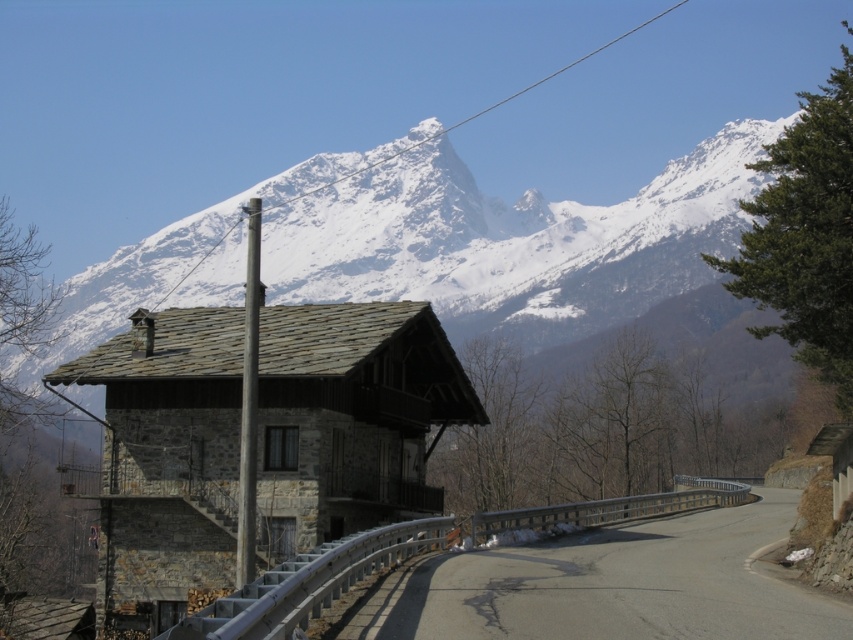
Which of these two, snowy granite mountain range at upper center or metallic gray pole at center, stands taller?

snowy granite mountain range at upper center

Is snowy granite mountain range at upper center bigger than metallic gray pole at center?

Correct, snowy granite mountain range at upper center is larger in size than metallic gray pole at center.

This screenshot has height=640, width=853. What are the coordinates of `snowy granite mountain range at upper center` in the screenshot? It's located at [514, 241].

Locate an element on the screen. snowy granite mountain range at upper center is located at coordinates (514, 241).

Can you confirm if snowy granite mountain range at upper center is thinner than asphalt road at center?

Incorrect, snowy granite mountain range at upper center's width is not less than asphalt road at center's.

Does snowy granite mountain range at upper center lie behind asphalt road at center?

Yes, it is.

The height and width of the screenshot is (640, 853). In order to click on snowy granite mountain range at upper center in this screenshot , I will do `click(514, 241)`.

Where is `snowy granite mountain range at upper center`? Image resolution: width=853 pixels, height=640 pixels. snowy granite mountain range at upper center is located at coordinates (514, 241).

Does asphalt road at center lie in front of metallic gray pole at center?

Yes, it is in front of metallic gray pole at center.

In the scene shown: Is asphalt road at center to the right of metallic gray pole at center from the viewer's perspective?

Indeed, asphalt road at center is positioned on the right side of metallic gray pole at center.

The width and height of the screenshot is (853, 640). I want to click on asphalt road at center, so click(x=608, y=586).

This screenshot has height=640, width=853. I want to click on asphalt road at center, so click(608, 586).